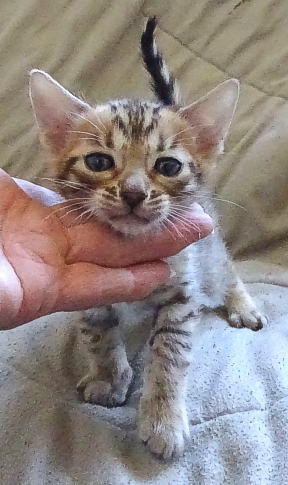
The height and width of the screenshot is (485, 288). I want to click on blanket, so click(x=233, y=384).